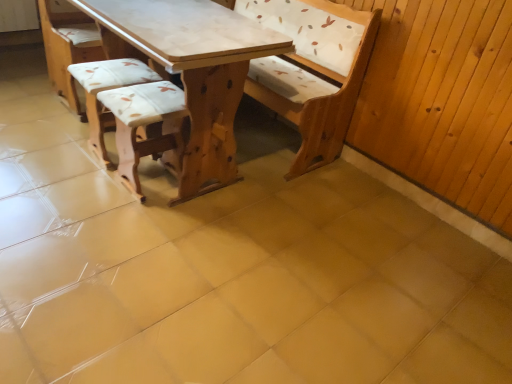
At what (x,y) coordinates should I click in order to perform the action: click on free spot in front of wooden textured stool at center, the second armchair positioned from the left. Please return your answer as a coordinate pair (x, y). This screenshot has width=512, height=384. Looking at the image, I should click on (128, 221).